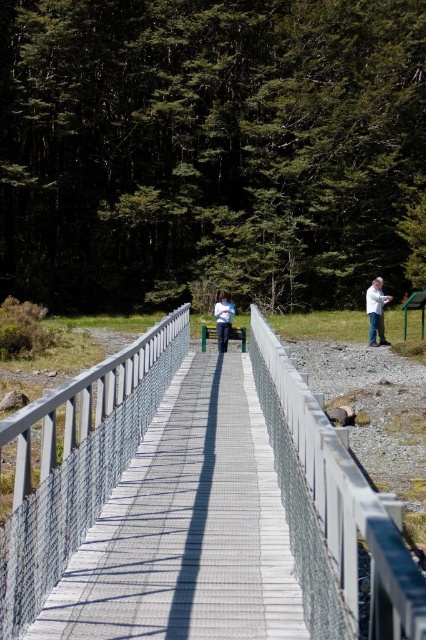
Between white matte shirt at right and light blue fabric jacket at center, which one has less height?

white matte shirt at right is shorter.

Who is positioned more to the left, white matte shirt at right or light blue fabric jacket at center?

light blue fabric jacket at center is more to the left.

Between point (379, 339) and point (226, 342), which one is positioned behind?

Positioned behind is point (379, 339).

You are a GUI agent. You are given a task and a screenshot of the screen. Output one action in this format:
    pyautogui.click(x=<x>, y=<y>)
    Task: Click on the white matte shirt at right
    Image resolution: width=426 pixels, height=640 pixels.
    Given the screenshot: What is the action you would take?
    coord(376,310)

Does point (81, 476) lie behind point (385, 300)?

No.

Identify the location of metal mesh bridge at center. (77, 461).

Is point (52, 580) positioned in front of point (226, 300)?

Yes, it is in front of point (226, 300).

Can you confirm if metal mesh bridge at center is bigger than light blue fabric jacket at center?

Yes.

Is point (354, 545) in front of point (221, 352)?

Yes, it is.

The width and height of the screenshot is (426, 640). I want to click on metal mesh bridge at center, so click(77, 461).